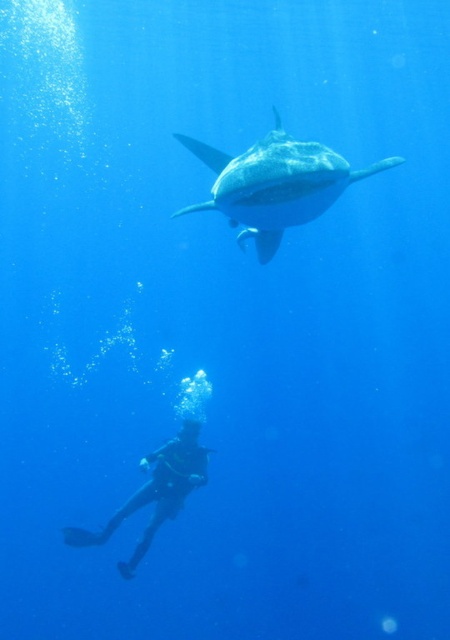
You are a marine biologist studying the underwater environment. You notice a point at coordinates (274, 184) in the image. Based on the scene description, can you determine which object this point is located on?

The point at coordinates (274, 184) is located on the smooth gray shark at upper center.

You are a marine biologist observing an underwater scene. You notice two objects in the image. One is a smooth gray shark at upper center and the other is a black rubber wetsuit at lower left. Based on their positions, which object is located to the right of the other?

The smooth gray shark at upper center is positioned on the right side of the black rubber wetsuit at lower left.